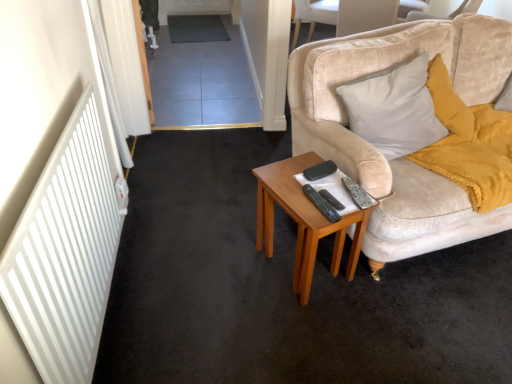
Question: Is black plastic remote control at center, which ranks as the 2th remote control in left-to-right order, smaller than velvet beige chair at upper center?

Choices:
 (A) yes
 (B) no

Answer: (A)

Question: Is black plastic remote control at center, which ranks as the 2th remote control in left-to-right order, positioned beyond the bounds of velvet beige chair at upper center?

Choices:
 (A) yes
 (B) no

Answer: (A)

Question: Can you confirm if black plastic remote control at center, which is the second remote control from right to left, is wider than velvet beige chair at upper center?

Choices:
 (A) yes
 (B) no

Answer: (B)

Question: Is velvet beige chair at upper center located within black plastic remote control at center, which is the second remote control from right to left?

Choices:
 (A) no
 (B) yes

Answer: (A)

Question: Does black plastic remote control at center, which ranks as the 2th remote control in left-to-right order, come behind velvet beige chair at upper center?

Choices:
 (A) yes
 (B) no

Answer: (B)

Question: Is the surface of black plastic remote control at center, which ranks as the 2th remote control in left-to-right order, in direct contact with velvet beige chair at upper center?

Choices:
 (A) yes
 (B) no

Answer: (B)

Question: From a real-world perspective, does velvet beige chair at upper center sit lower than black plastic remote control at center, the 1th remote control when ordered from left to right?

Choices:
 (A) no
 (B) yes

Answer: (B)

Question: Is velvet beige chair at upper center shorter than black plastic remote control at center, marked as the 3th remote control in a right-to-left arrangement?

Choices:
 (A) yes
 (B) no

Answer: (B)

Question: Are velvet beige chair at upper center and black plastic remote control at center, marked as the 3th remote control in a right-to-left arrangement, beside each other?

Choices:
 (A) yes
 (B) no

Answer: (B)

Question: Is black plastic remote control at center, marked as the 3th remote control in a right-to-left arrangement, completely or partially inside velvet beige chair at upper center?

Choices:
 (A) no
 (B) yes

Answer: (A)

Question: From the image's perspective, does velvet beige chair at upper center appear higher than black plastic remote control at center, the 1th remote control when ordered from left to right?

Choices:
 (A) yes
 (B) no

Answer: (A)

Question: From the image's perspective, is velvet beige chair at upper center under black plastic remote control at center, the 1th remote control when ordered from left to right?

Choices:
 (A) no
 (B) yes

Answer: (A)

Question: From the image's perspective, is black plastic remote control at center, which is the second remote control from right to left, located above black plastic remote control at center, marked as the 3th remote control in a right-to-left arrangement?

Choices:
 (A) no
 (B) yes

Answer: (B)